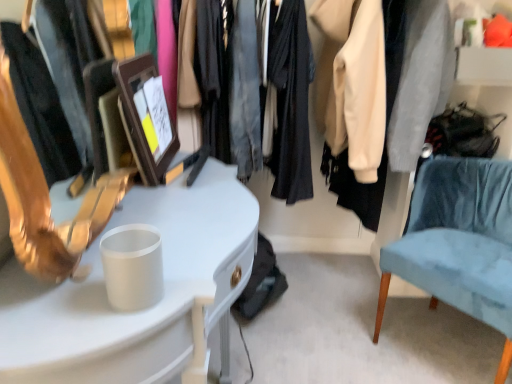
The height and width of the screenshot is (384, 512). In order to click on free point below velvet blue chair at right (from a real-world perspective) in this screenshot , I will do `click(446, 342)`.